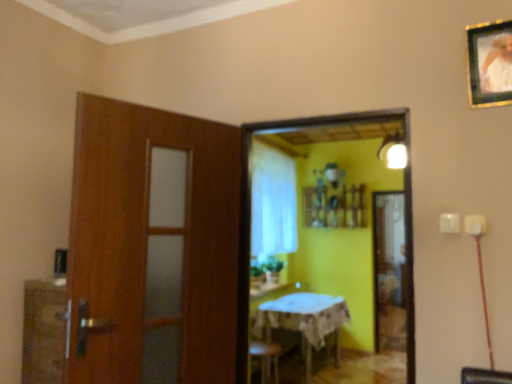
Question: Considering the relative positions of white sheer curtain at center and wooden framed portrait at upper right in the image provided, is white sheer curtain at center to the right of wooden framed portrait at upper right from the viewer's perspective?

Choices:
 (A) no
 (B) yes

Answer: (A)

Question: Considering the relative sizes of white sheer curtain at center and wooden framed portrait at upper right in the image provided, is white sheer curtain at center bigger than wooden framed portrait at upper right?

Choices:
 (A) yes
 (B) no

Answer: (A)

Question: Can you confirm if white sheer curtain at center is shorter than wooden framed portrait at upper right?

Choices:
 (A) no
 (B) yes

Answer: (A)

Question: Considering the relative sizes of white sheer curtain at center and wooden framed portrait at upper right in the image provided, is white sheer curtain at center taller than wooden framed portrait at upper right?

Choices:
 (A) yes
 (B) no

Answer: (A)

Question: From a real-world perspective, is white sheer curtain at center positioned under wooden framed portrait at upper right based on gravity?

Choices:
 (A) no
 (B) yes

Answer: (B)

Question: Does point (294, 297) appear closer or farther from the camera than point (490, 31)?

Choices:
 (A) closer
 (B) farther

Answer: (B)

Question: Considering the positions of white cloth-covered table at center and wooden framed portrait at upper right in the image, is white cloth-covered table at center wider or thinner than wooden framed portrait at upper right?

Choices:
 (A) thin
 (B) wide

Answer: (B)

Question: In terms of size, does white cloth-covered table at center appear bigger or smaller than wooden framed portrait at upper right?

Choices:
 (A) big
 (B) small

Answer: (A)

Question: From the image's perspective, is white cloth-covered table at center located above or below wooden framed portrait at upper right?

Choices:
 (A) below
 (B) above

Answer: (A)

Question: Is wooden framed portrait at upper right wider or thinner than wooden framed mirror at center?

Choices:
 (A) thin
 (B) wide

Answer: (A)

Question: From a real-world perspective, is wooden framed portrait at upper right above or below wooden framed mirror at center?

Choices:
 (A) above
 (B) below

Answer: (A)

Question: In the image, is wooden framed portrait at upper right positioned in front of or behind wooden framed mirror at center?

Choices:
 (A) behind
 (B) front

Answer: (B)

Question: From the image's perspective, relative to wooden framed mirror at center, is wooden framed portrait at upper right above or below?

Choices:
 (A) above
 (B) below

Answer: (A)

Question: From a real-world perspective, is wooden framed portrait at upper right positioned above or below matte white light fixture at upper right?

Choices:
 (A) below
 (B) above

Answer: (A)

Question: Visually, is wooden framed portrait at upper right positioned to the left or to the right of matte white light fixture at upper right?

Choices:
 (A) right
 (B) left

Answer: (B)